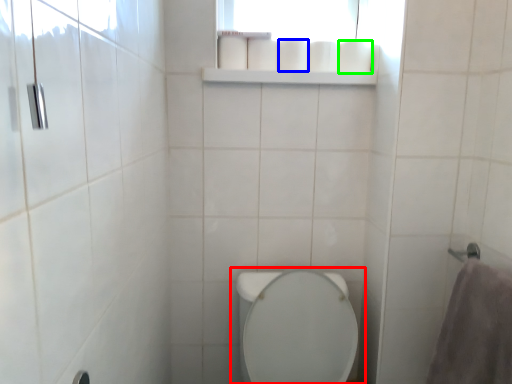
Question: Which is farther away from toilet (highlighted by a red box)? toilet paper (highlighted by a blue box) or toilet paper (highlighted by a green box)?

Choices:
 (A) toilet paper
 (B) toilet paper

Answer: (B)